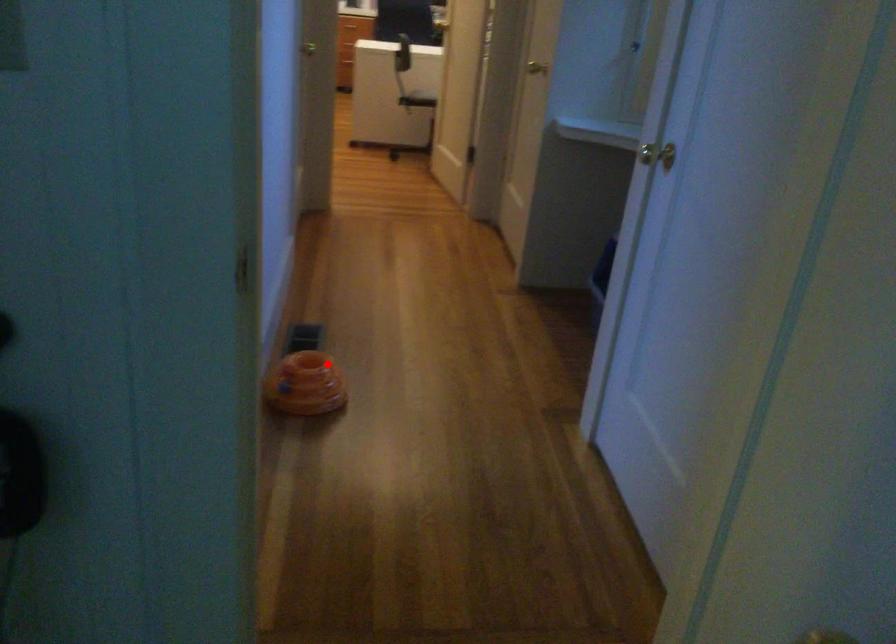
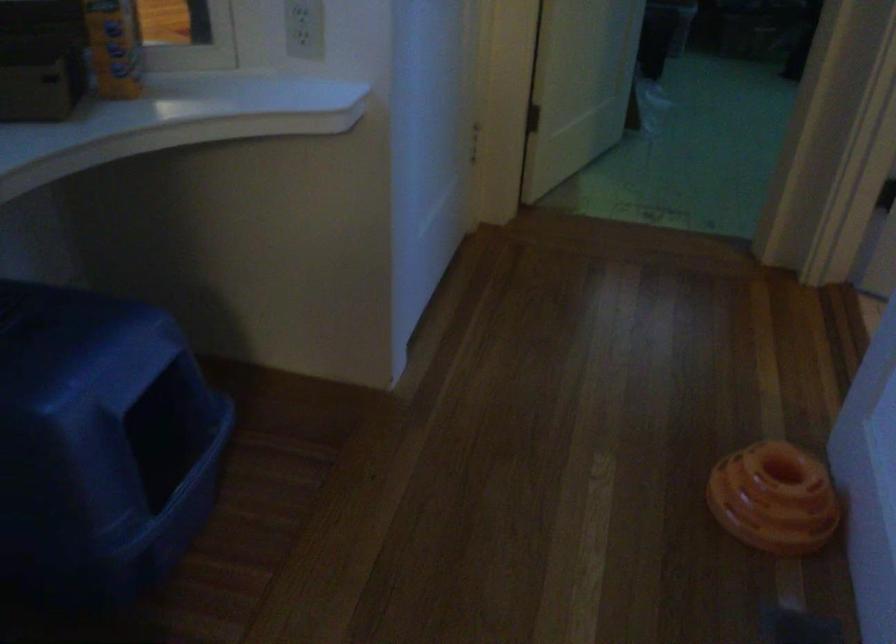
The point at the highlighted location is marked in the first image. Where is the corresponding point in the second image?

(773, 498)